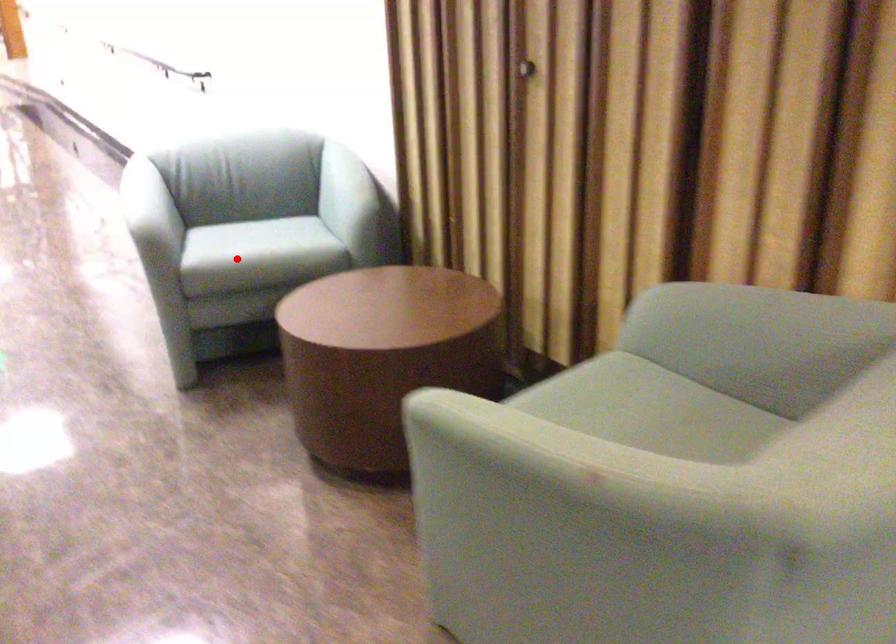
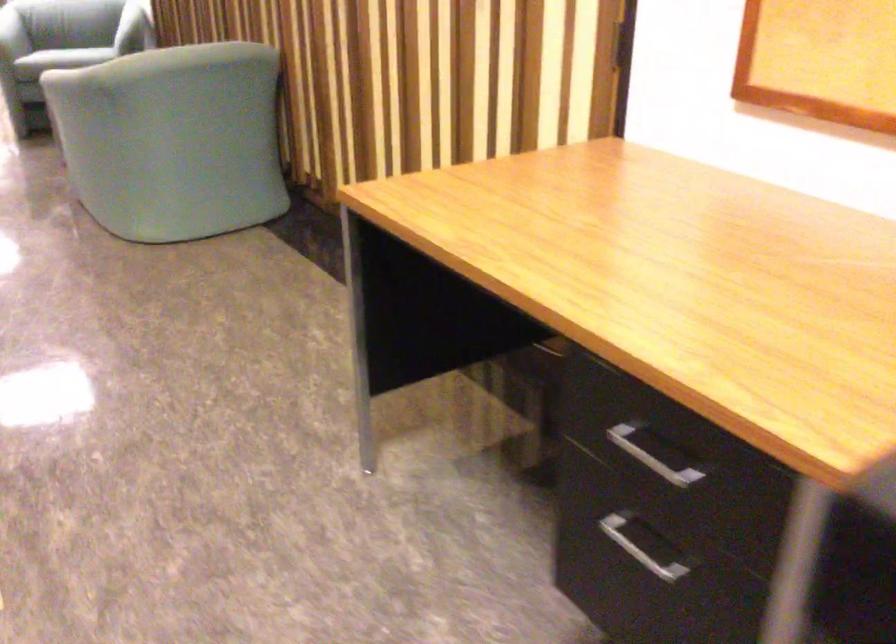
Where in the second image is the point corresponding to the highlighted location from the first image?

(12, 35)